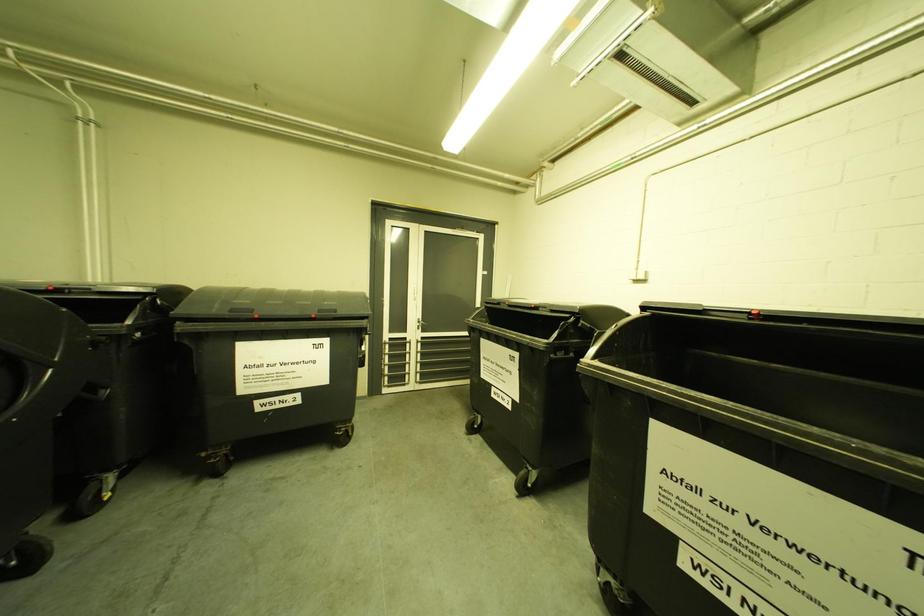
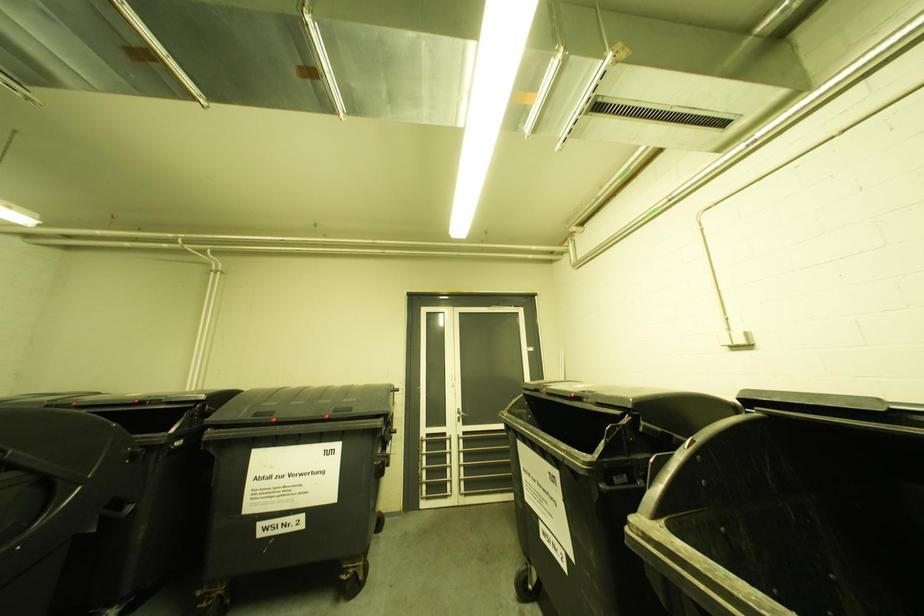
Consider the image. The images are taken continuously from a first-person perspective. In which direction are you moving?

The cameraman walked toward right, forward.